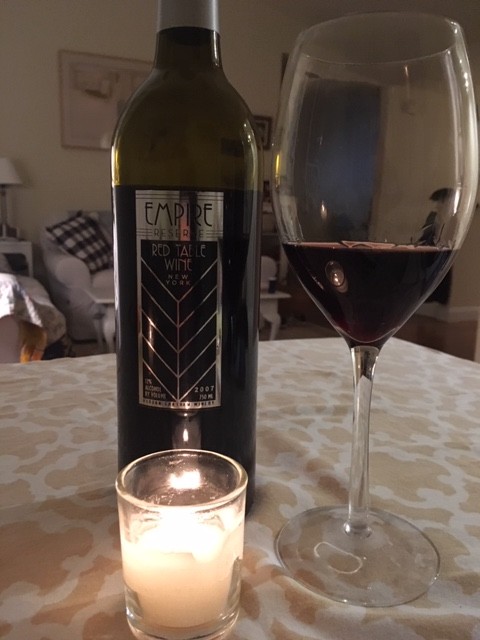
The image size is (480, 640). In order to click on candle in this screenshot , I will do `click(184, 608)`.